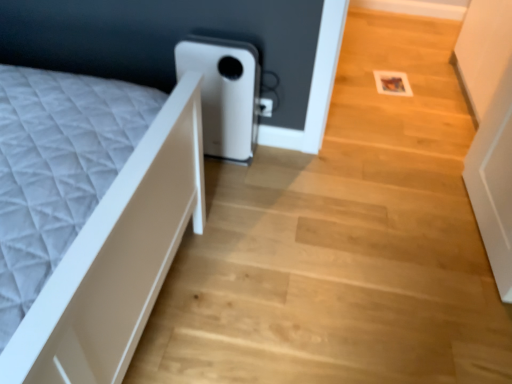
Find the location of a particular element. This screenshot has height=384, width=512. free location to the right of white matte water heater at center is located at coordinates (274, 163).